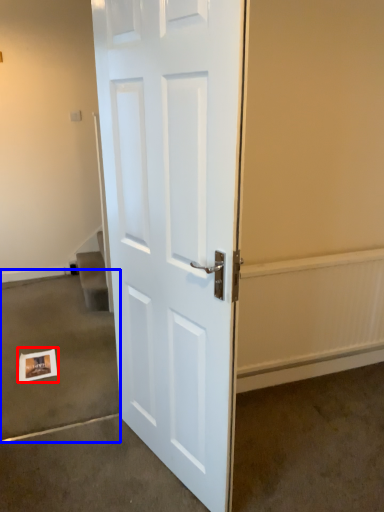
Question: Which of the following is the closest to the observer, postcard (highlighted by a red box) or concrete (highlighted by a blue box)?

Choices:
 (A) postcard
 (B) concrete

Answer: (B)